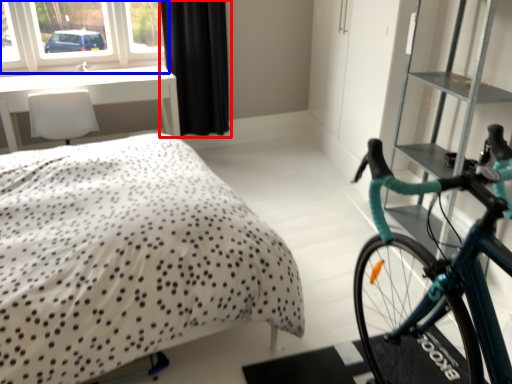
Question: Which of the following is the closest to the observer, curtain (highlighted by a red box) or window (highlighted by a blue box)?

Choices:
 (A) curtain
 (B) window

Answer: (B)